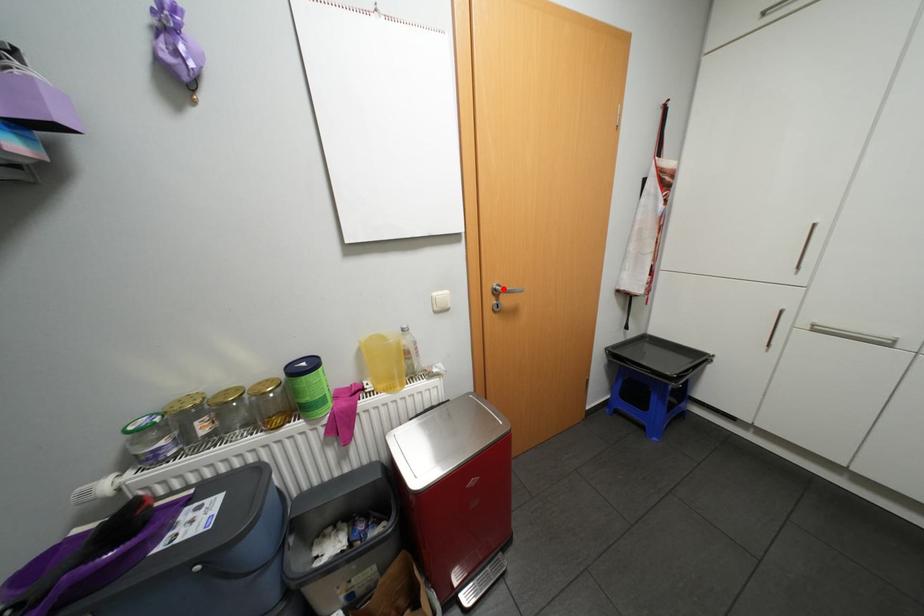
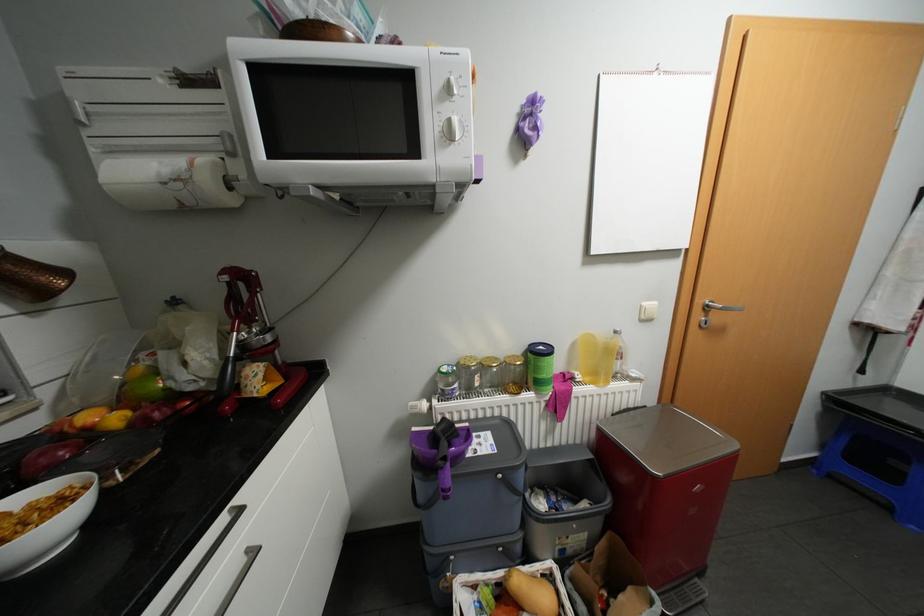
In the second image, find the point that corresponds to the highlighted location in the first image.

(715, 305)